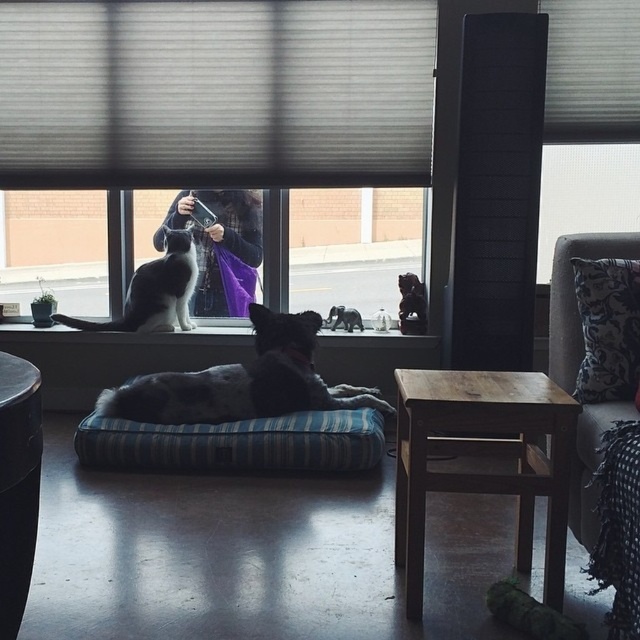
Does wooden stool at lower right appear under blue striped cushion at center?

No.

Is point (433, 410) closer to camera compared to point (268, 420)?

Yes, point (433, 410) is closer to viewer.

Where is `wooden stool at lower right`? Image resolution: width=640 pixels, height=640 pixels. wooden stool at lower right is located at coordinates (483, 460).

The width and height of the screenshot is (640, 640). Find the location of `wooden stool at lower right`. wooden stool at lower right is located at coordinates (483, 460).

Can you confirm if gray fabric couch at right is smaller than black and white fur at center?

Yes, gray fabric couch at right is smaller than black and white fur at center.

Looking at this image, is gray fabric couch at right thinner than black and white fur at center?

Indeed, gray fabric couch at right has a lesser width compared to black and white fur at center.

What do you see at coordinates (602, 404) in the screenshot?
I see `gray fabric couch at right` at bounding box center [602, 404].

Locate an element on the screen. gray fabric couch at right is located at coordinates (602, 404).

From the picture: Who is positioned more to the left, black damask pillow at right or black glossy statue at window?

black glossy statue at window

Is black damask pillow at right bigger than black glossy statue at window?

Indeed, black damask pillow at right has a larger size compared to black glossy statue at window.

Identify the location of black damask pillow at right. The image size is (640, 640). (608, 328).